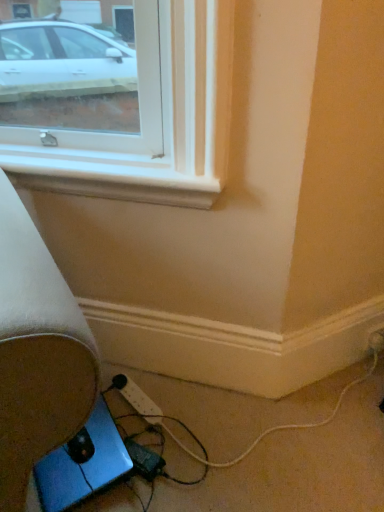
Question: Looking at their shapes, would you say white plastic power strip at lower center, the second extension cord positioned from the front, is wider or thinner than white plastic power strip at lower right?

Choices:
 (A) wide
 (B) thin

Answer: (A)

Question: From a real-world perspective, relative to white plastic power strip at lower right, is white plastic power strip at lower center, the 1th extension cord from the back, vertically above or below?

Choices:
 (A) above
 (B) below

Answer: (B)

Question: Which object is the closest to the blue metallic laptop at lower left?

Choices:
 (A) white plastic power strip at lower center, the second extension cord positioned from the front
 (B) black plastic extension cord at lower center, which appears as the 2th extension cord when viewed from the back
 (C) white plastic power strip at lower right

Answer: (B)

Question: Which object is the closest to the white plastic power strip at lower center, the 1th extension cord from the back?

Choices:
 (A) black plastic extension cord at lower center, which is counted as the 1th extension cord, starting from the front
 (B) blue metallic laptop at lower left
 (C) white plastic power strip at lower right

Answer: (A)